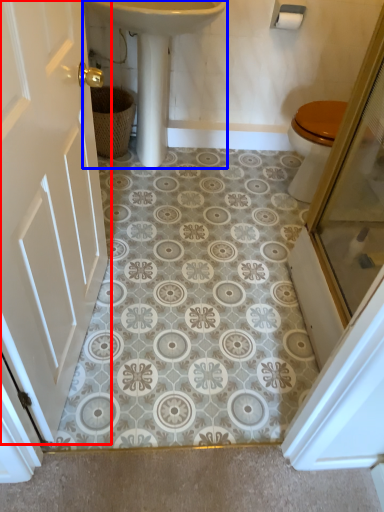
Question: Which point is closer to the camera, door (highlighted by a red box) or sink (highlighted by a blue box)?

Choices:
 (A) door
 (B) sink

Answer: (A)